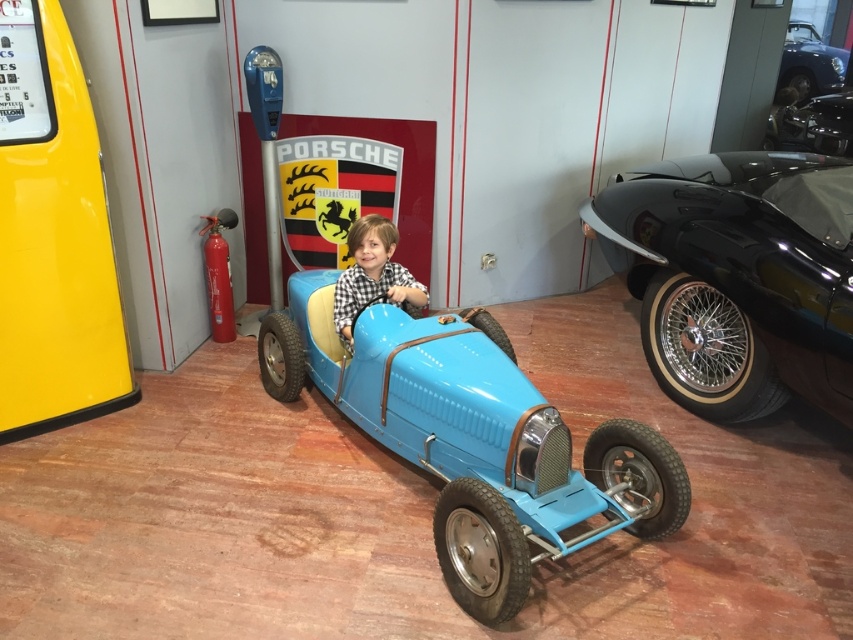
Can you confirm if shiny black car at right is positioned above shiny black car at upper right?

Actually, shiny black car at right is below shiny black car at upper right.

In the scene shown: Who is positioned more to the right, shiny black car at right or shiny black car at upper right?

shiny black car at upper right is more to the right.

What do you see at coordinates (737, 276) in the screenshot? This screenshot has width=853, height=640. I see `shiny black car at right` at bounding box center [737, 276].

Identify the location of shiny black car at right. Image resolution: width=853 pixels, height=640 pixels. (737, 276).

Between point (352, 289) and point (840, 132), which one is positioned in front?

Point (352, 289) is more forward.

Does matte blue car at center lie in front of shiny chrome engine at center?

Yes, it is.

Locate an element on the screen. matte blue car at center is located at coordinates (372, 275).

Between matte blue toy car at center and shiny chrome engine at center, which one appears on the right side from the viewer's perspective?

shiny chrome engine at center is more to the right.

Is point (523, 557) more distant than point (842, 150)?

No, it is not.

Image resolution: width=853 pixels, height=640 pixels. What are the coordinates of `matte blue toy car at center` in the screenshot? It's located at (473, 436).